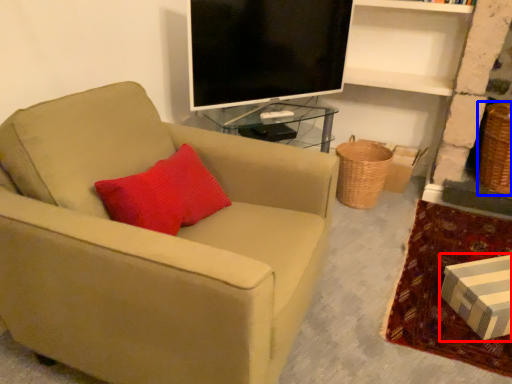
Question: Among these objects, which one is farthest to the camera, box (highlighted by a red box) or basket (highlighted by a blue box)?

Choices:
 (A) box
 (B) basket

Answer: (B)